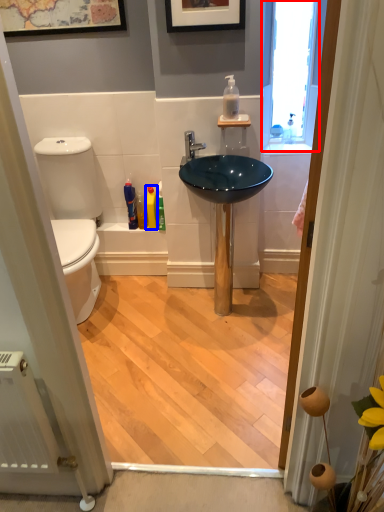
Question: Which object is closer to the camera taking this photo, window (highlighted by a red box) or toiletry (highlighted by a blue box)?

Choices:
 (A) window
 (B) toiletry

Answer: (A)